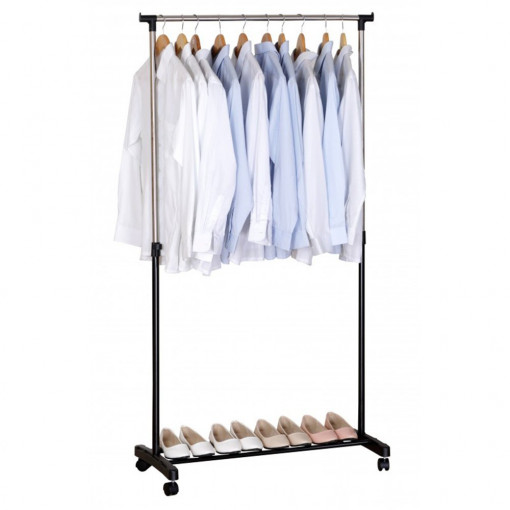
Image resolution: width=510 pixels, height=510 pixels. Find the location of `coat hangers`. coat hangers is located at coordinates (162, 39), (184, 39), (197, 39), (219, 39), (246, 37), (267, 36), (282, 34), (301, 38), (324, 38), (345, 38).